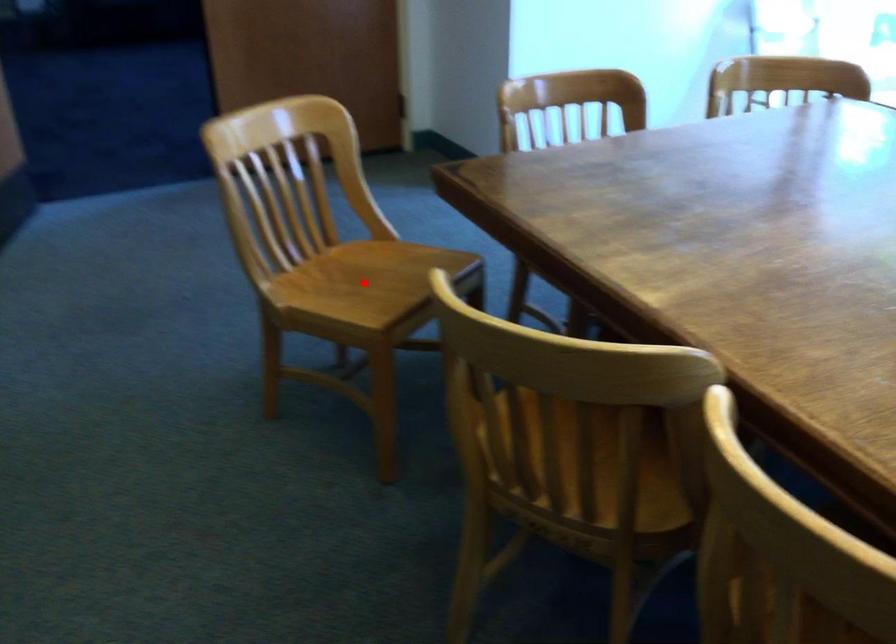
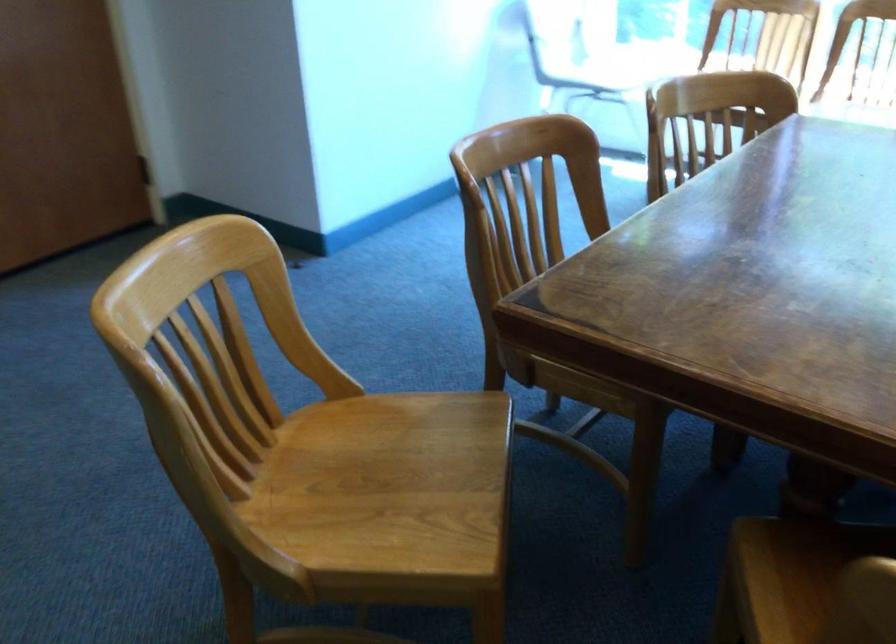
Find the pixel in the second image that matches the highlighted location in the first image.

(383, 484)